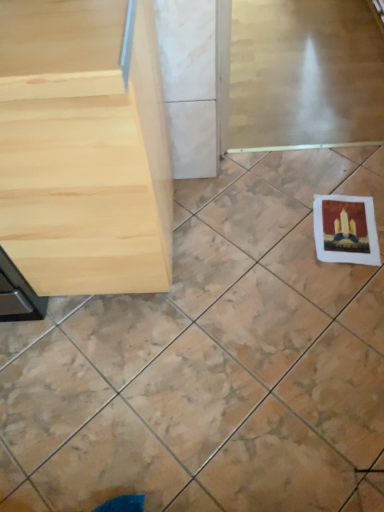
I want to click on white matte coaster at lower right, so 212,361.

What do you see at coordinates (345, 229) in the screenshot? This screenshot has width=384, height=512. I see `matte paper postcard at lower right` at bounding box center [345, 229].

What do you see at coordinates (305, 73) in the screenshot?
I see `clear glass screen door at upper center` at bounding box center [305, 73].

You are a GUI agent. You are given a task and a screenshot of the screen. Output one action in this format:
    pyautogui.click(x=<x>, y=<y>)
    Task: Click on the light wood table at left
    
    Given the screenshot: What is the action you would take?
    point(83,150)

Which is more to the left, white matte coaster at lower right or clear glass screen door at upper center?

white matte coaster at lower right.

Is white matte coaster at lower right inside or outside of clear glass screen door at upper center?

white matte coaster at lower right is not inside clear glass screen door at upper center, it's outside.

Between point (221, 382) and point (368, 35), which one is positioned in front?

The point (221, 382) is more forward.

Is light wood table at left at the right side of matte paper postcard at lower right?

No.

Is light wood table at left situated inside matte paper postcard at lower right or outside?

light wood table at left exists outside the volume of matte paper postcard at lower right.

From the image's perspective, is light wood table at left under matte paper postcard at lower right?

Actually, light wood table at left appears above matte paper postcard at lower right in the image.

Could you tell me if light wood table at left is turned towards matte paper postcard at lower right?

No, light wood table at left is not turned towards matte paper postcard at lower right.

In the scene shown: Considering the sizes of clear glass screen door at upper center and matte paper postcard at lower right in the image, is clear glass screen door at upper center bigger or smaller than matte paper postcard at lower right?

In the image, clear glass screen door at upper center appears to be larger than matte paper postcard at lower right.

How distant is clear glass screen door at upper center from matte paper postcard at lower right?

clear glass screen door at upper center and matte paper postcard at lower right are 69.96 centimeters apart from each other.

Looking at their sizes, would you say clear glass screen door at upper center is wider or thinner than matte paper postcard at lower right?

In the image, clear glass screen door at upper center appears to be wider than matte paper postcard at lower right.

Is clear glass screen door at upper center not near matte paper postcard at lower right?

clear glass screen door at upper center is near matte paper postcard at lower right, not far away.

Can you tell me how much light wood table at left and clear glass screen door at upper center differ in facing direction?

There is a 1.44-degree angle between the facing directions of light wood table at left and clear glass screen door at upper center.

In the image, is light wood table at left positioned in front of or behind clear glass screen door at upper center?

A: In the image, light wood table at left appears in front of clear glass screen door at upper center.

Could you tell me if light wood table at left is turned towards clear glass screen door at upper center?

No, light wood table at left is not facing towards clear glass screen door at upper center.

At what (x,y) coordinates should I click in order to perform the action: click on furniture below the clear glass screen door at upper center (from the image's perspective). Please return your answer as a coordinate pair (x, y). This screenshot has width=384, height=512. Looking at the image, I should click on (83, 150).

Is white matte coaster at lower right in front of matte paper postcard at lower right?

Yes.

Considering the positions of point (380, 322) and point (373, 221), is point (380, 322) closer or farther from the camera than point (373, 221)?

Point (380, 322) is closer to the camera than point (373, 221).

How different are the orientations of white matte coaster at lower right and matte paper postcard at lower right in degrees?

173 degrees.

Between white matte coaster at lower right and matte paper postcard at lower right, which one appears on the left side from the viewer's perspective?

white matte coaster at lower right is more to the left.

Between matte paper postcard at lower right and light wood table at left, which one has more height?

With more height is light wood table at left.

From a real-world perspective, which object rests below the other?

From a 3D spatial view, matte paper postcard at lower right is below.

Which is correct: matte paper postcard at lower right is inside light wood table at left, or outside of it?

matte paper postcard at lower right is not inside light wood table at left, it's outside.

Can you confirm if matte paper postcard at lower right is smaller than light wood table at left?

Yes.

Is matte paper postcard at lower right inside the boundaries of white matte coaster at lower right, or outside?

matte paper postcard at lower right is inside white matte coaster at lower right.

Considering the positions of objects matte paper postcard at lower right and white matte coaster at lower right in the image provided, who is in front, matte paper postcard at lower right or white matte coaster at lower right?

white matte coaster at lower right is more forward.

Can you confirm if matte paper postcard at lower right is wider than white matte coaster at lower right?

No.

You are a GUI agent. You are given a task and a screenshot of the screen. Output one action in this format:
    pyautogui.click(x=<x>, y=<y>)
    Task: Click on the ceramic tile lying on the left of clear glass screen door at upper center
    
    Given the screenshot: What is the action you would take?
    pyautogui.click(x=212, y=361)

In the image, there is a matte paper postcard at lower right. What are the coordinates of `furniture above it (from the image's perspective)` in the screenshot? It's located at 83,150.

When comparing their distances from matte paper postcard at lower right, does clear glass screen door at upper center or light wood table at left seem further?

light wood table at left.

Which object lies further to the anchor point light wood table at left, matte paper postcard at lower right or clear glass screen door at upper center?

clear glass screen door at upper center.

When comparing their distances from white matte coaster at lower right, does clear glass screen door at upper center or light wood table at left seem further?

clear glass screen door at upper center lies further to white matte coaster at lower right than the other object.

Based on their spatial positions, is white matte coaster at lower right or matte paper postcard at lower right closer to light wood table at left?

white matte coaster at lower right.

Based on their spatial positions, is white matte coaster at lower right or clear glass screen door at upper center closer to light wood table at left?

white matte coaster at lower right is positioned closer to the anchor light wood table at left.

In the scene shown: Considering their positions, is matte paper postcard at lower right positioned closer to light wood table at left than white matte coaster at lower right?

Based on the image, white matte coaster at lower right appears to be nearer to light wood table at left.

When comparing their distances from white matte coaster at lower right, does matte paper postcard at lower right or clear glass screen door at upper center seem further?

clear glass screen door at upper center is further to white matte coaster at lower right.

Considering their positions, is matte paper postcard at lower right positioned closer to clear glass screen door at upper center than light wood table at left?

matte paper postcard at lower right.

Where is `ceramic tile located between light wood table at left and clear glass screen door at upper center in the depth direction`? The image size is (384, 512). ceramic tile located between light wood table at left and clear glass screen door at upper center in the depth direction is located at coordinates (212, 361).

Where is `ceramic tile between light wood table at left and matte paper postcard at lower right from left to right`? The image size is (384, 512). ceramic tile between light wood table at left and matte paper postcard at lower right from left to right is located at coordinates (212, 361).

This screenshot has height=512, width=384. What are the coordinates of `postcard between light wood table at left and clear glass screen door at upper center from front to back` in the screenshot? It's located at (345, 229).

Identify the location of postcard between clear glass screen door at upper center and white matte coaster at lower right from top to bottom. The height and width of the screenshot is (512, 384). (345, 229).